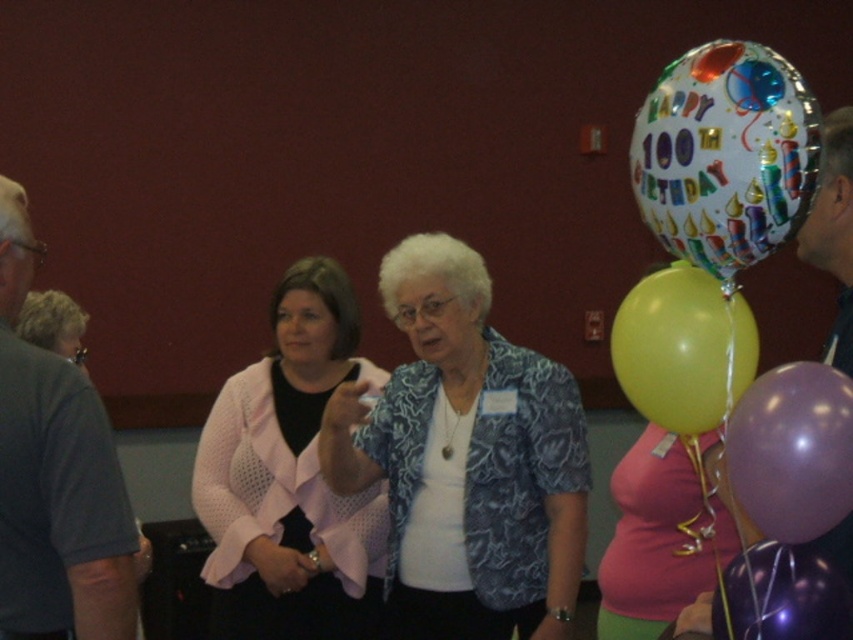
Between gray t-shirt at left and matte yellow balloon at right, which one appears on the right side from the viewer's perspective?

From the viewer's perspective, matte yellow balloon at right appears more on the right side.

Which is in front, point (71, 403) or point (671, 291)?

Positioned in front is point (671, 291).

At what (x,y) coordinates should I click in order to perform the action: click on gray t-shirt at left. Please return your answer as a coordinate pair (x, y). The image size is (853, 640). Looking at the image, I should click on (55, 476).

This screenshot has height=640, width=853. What are the coordinates of `gray t-shirt at left` in the screenshot? It's located at (55, 476).

Can you confirm if gray t-shirt at left is bigger than pink fabric dress at lower right?

Actually, gray t-shirt at left might be smaller than pink fabric dress at lower right.

Who is positioned more to the left, gray t-shirt at left or pink fabric dress at lower right?

Positioned to the left is gray t-shirt at left.

Does point (47, 417) come in front of point (691, 593)?

Yes.

At what (x,y) coordinates should I click in order to perform the action: click on gray t-shirt at left. Please return your answer as a coordinate pair (x, y). This screenshot has width=853, height=640. Looking at the image, I should click on (55, 476).

Between point (636, 564) and point (653, 340), which one is positioned behind?

The point (636, 564) is behind.

The image size is (853, 640). Find the location of `pink fabric dress at lower right`. pink fabric dress at lower right is located at coordinates (657, 540).

Identify the location of pink fabric dress at lower right. (657, 540).